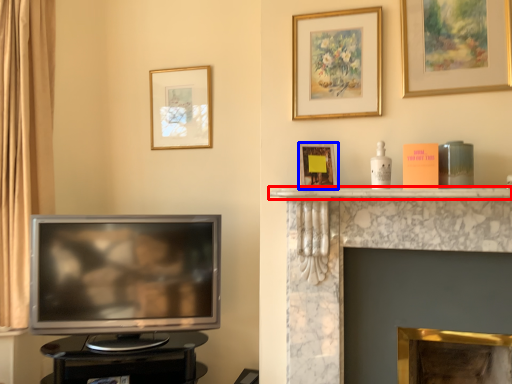
Question: Which object appears closest to the camera in this image, mantle (highlighted by a red box) or picture frame (highlighted by a blue box)?

Choices:
 (A) mantle
 (B) picture frame

Answer: (A)